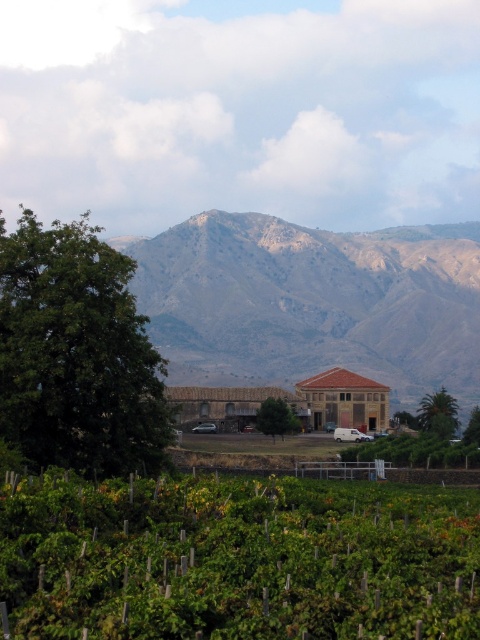
You are standing in the vineyard and looking towards the brown rocky mountain range at upper center and the green leafy tree at lower right. Which object is closer to you?

The green leafy tree at lower right is closer to you since it is positioned below the brown rocky mountain range at upper center, which is further away.

You are a photographer planning to capture the entire scene in one shot. Given that the green leafy vineyard at lower center and the green leafy palm at right are both in frame, which object would require more space in your camera frame?

The green leafy vineyard at lower center requires more space in the camera frame because it is larger in size than the green leafy palm at right.